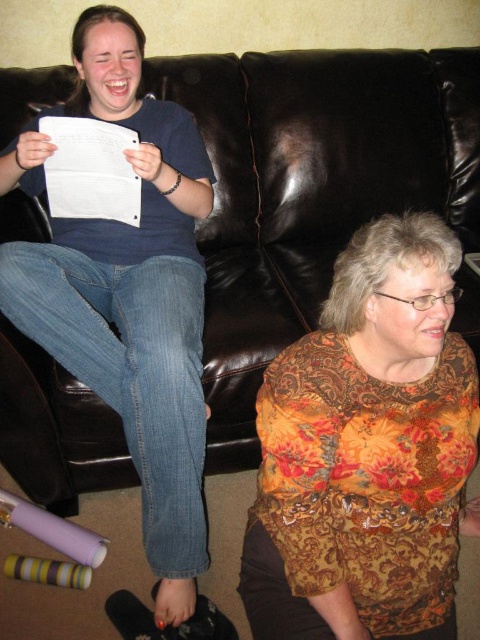
Does brown leather couch at center have a smaller size compared to floral-patterned blouse at center?

No, brown leather couch at center is not smaller than floral-patterned blouse at center.

Is brown leather couch at center below floral-patterned blouse at center?

Incorrect, brown leather couch at center is not positioned below floral-patterned blouse at center.

Who is more distant from viewer, (355, 205) or (406, 467)?

The point (355, 205) is behind.

Locate an element on the screen. This screenshot has width=480, height=640. brown leather couch at center is located at coordinates (311, 189).

Between brown leather couch at center and white paper at upper left, which one has less height?

white paper at upper left

Who is lower down, brown leather couch at center or white paper at upper left?

white paper at upper left

Is point (238, 77) behind point (56, 138)?

Yes, point (238, 77) is behind point (56, 138).

You are a GUI agent. You are given a task and a screenshot of the screen. Output one action in this format:
    pyautogui.click(x=<x>, y=<y>)
    Task: Click on the brown leather couch at center
    
    Given the screenshot: What is the action you would take?
    tap(311, 189)

Does point (290, 371) come closer to viewer compared to point (91, 144)?

Yes.

Measure the distance between floral-patterned blouse at center and camera.

floral-patterned blouse at center is 36.83 inches from camera.

Is point (372, 470) farther from camera compared to point (132, 195)?

No, (372, 470) is closer to viewer.

At what (x,y) coordinates should I click in order to perform the action: click on floral-patterned blouse at center. Please return your answer as a coordinate pair (x, y). The width and height of the screenshot is (480, 640). Looking at the image, I should click on (367, 451).